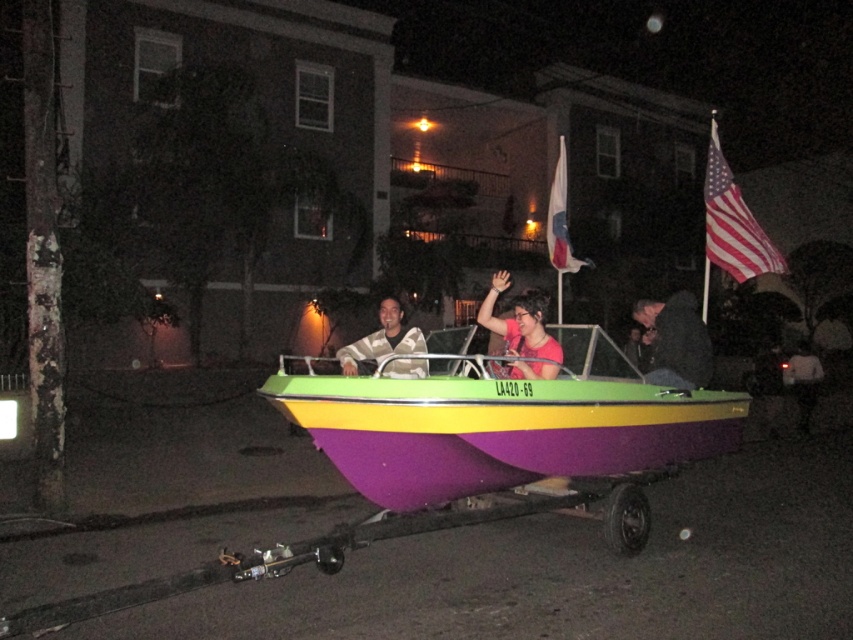
Who is lower down, american flag at upper right or dark gray fabric jacket at center?

dark gray fabric jacket at center is below.

Does point (706, 234) come closer to viewer compared to point (706, 349)?

No, (706, 234) is further to viewer.

I want to click on american flag at upper right, so click(732, 225).

Is the position of matte pink shirt at center less distant than that of camouflage fabric shirt at center?

No.

Is point (538, 348) less distant than point (346, 362)?

Yes.

This screenshot has height=640, width=853. In order to click on matte pink shirt at center in this screenshot , I will do `click(521, 330)`.

Where is `matte pink shirt at center`? The image size is (853, 640). matte pink shirt at center is located at coordinates (521, 330).

Who is more distant from viewer, (775, 253) or (509, 372)?

Point (775, 253)

Is point (717, 253) positioned behind point (534, 378)?

Yes, it is behind point (534, 378).

Who is more forward, (747, 275) or (480, 305)?

Point (747, 275) is more forward.

Find the location of a particular element. american flag at upper right is located at coordinates (732, 225).